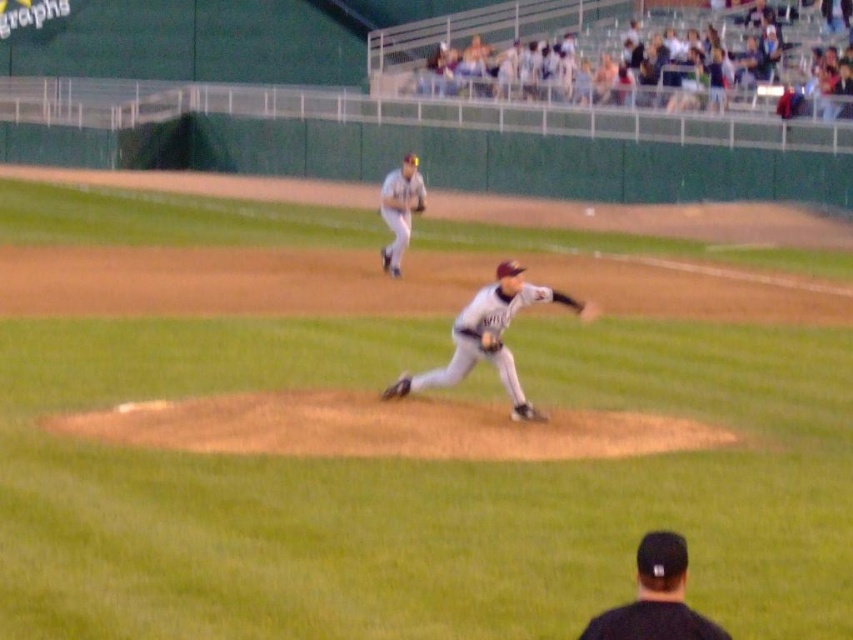
You are a baseball coach analyzing the field positions. You notice two points marked on the field at coordinates point (685, 620) and point (412, 198). Based on the image, which point is closer to the pitcher?

Point (685, 620) is in front of point (412, 198), so it is closer to the pitcher.

You are a photographer trying to capture the pitcher mid throw. You notice the black fabric cap at lower center and the dark gray leather glove at center. Which object is closer to the bottom edge of the photo?

The black fabric cap at lower center is closer to the bottom edge of the photo because it is positioned under the dark gray leather glove at center.